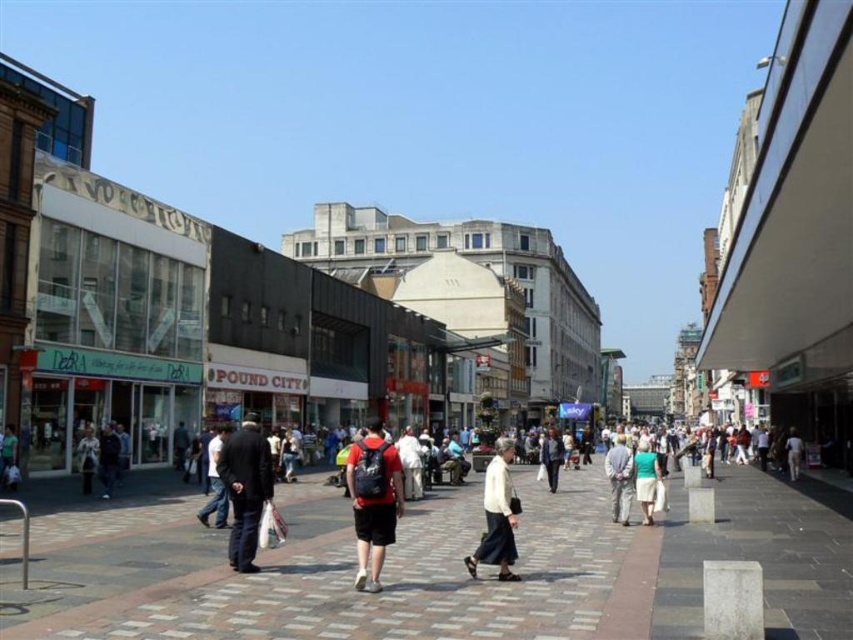
Question: Which is farther from the dark blue suit at left?

Choices:
 (A) dark blue jeans at center
 (B) light gray fabric pants at center
 (C) light green fabric dress at center

Answer: (A)

Question: Is paved stone pavement at center positioned behind light green fabric dress at center?

Choices:
 (A) no
 (B) yes

Answer: (A)

Question: Among these points, which one is farthest from the camera?

Choices:
 (A) (648, 468)
 (B) (625, 484)
 (C) (242, 452)
 (D) (792, 445)

Answer: (D)

Question: Does light gray fabric pants at center appear under light blue denim jacket at center?

Choices:
 (A) no
 (B) yes

Answer: (A)

Question: Can you confirm if matte red backpack at center is positioned to the right of white cotton skirt at center?

Choices:
 (A) no
 (B) yes

Answer: (A)

Question: Which point is farther from the camera taking this photo?

Choices:
 (A) (486, 513)
 (B) (556, 440)
 (C) (529, 529)
 (D) (791, 461)

Answer: (B)